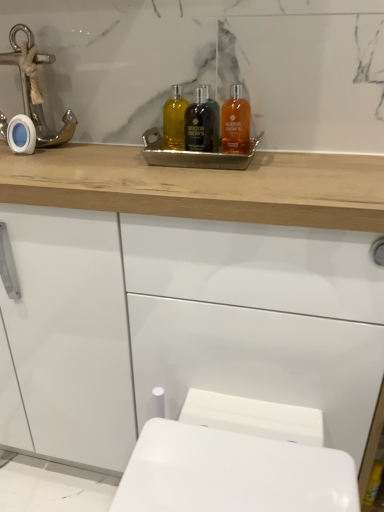
What are the coordinates of `vacant region to the left of translucent amber liquid at center, the 1th mouthwash positioned from the left` in the screenshot? It's located at 105,150.